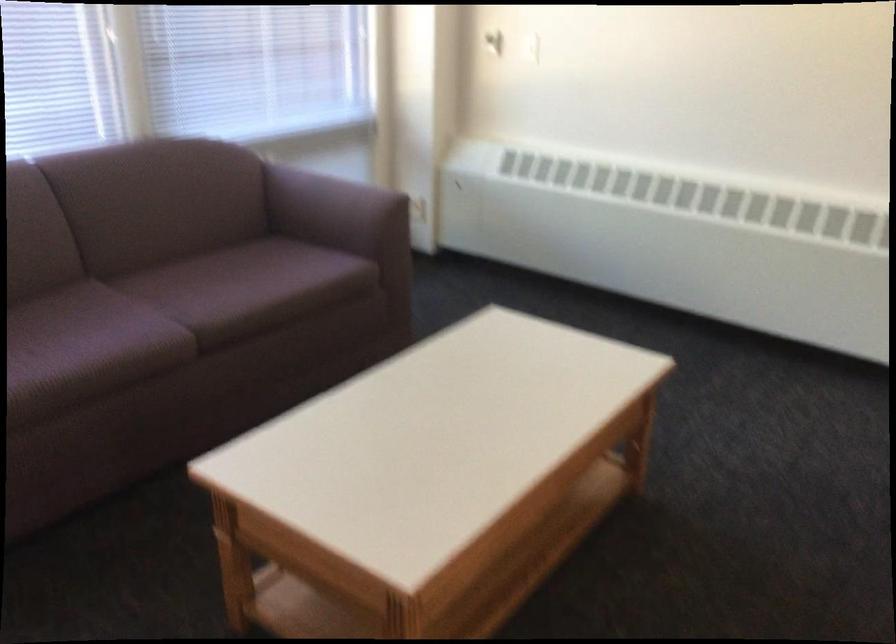
I want to click on sofa armrest, so click(336, 211).